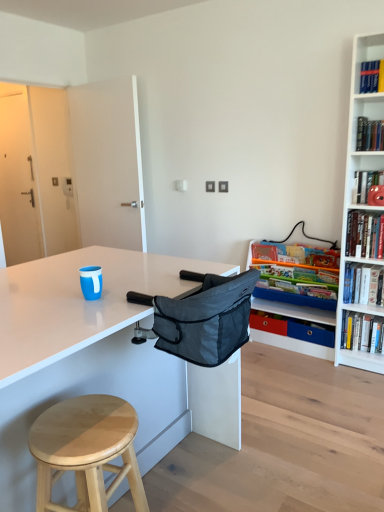
Question: Is red plastic drawer at lower right aimed at dark gray fabric folding chair at center?

Choices:
 (A) no
 (B) yes

Answer: (A)

Question: Would you say red plastic drawer at lower right is a long distance from dark gray fabric folding chair at center?

Choices:
 (A) no
 (B) yes

Answer: (B)

Question: Is red plastic drawer at lower right smaller than dark gray fabric folding chair at center?

Choices:
 (A) yes
 (B) no

Answer: (A)

Question: Is red plastic drawer at lower right behind dark gray fabric folding chair at center?

Choices:
 (A) yes
 (B) no

Answer: (A)

Question: Is the depth of red plastic drawer at lower right less than that of dark gray fabric folding chair at center?

Choices:
 (A) yes
 (B) no

Answer: (B)

Question: Is red plastic drawer at lower right taller than dark gray fabric folding chair at center?

Choices:
 (A) no
 (B) yes

Answer: (A)

Question: Does dark gray fabric folding chair at center have a greater width compared to hardcover book at upper right, marked as the fourth book in a top-to-bottom arrangement?

Choices:
 (A) yes
 (B) no

Answer: (A)

Question: Is dark gray fabric folding chair at center thinner than hardcover book at upper right, marked as the fourth book in a top-to-bottom arrangement?

Choices:
 (A) yes
 (B) no

Answer: (B)

Question: Is dark gray fabric folding chair at center positioned with its back to hardcover book at upper right, positioned as the first book in bottom-to-top order?

Choices:
 (A) yes
 (B) no

Answer: (B)

Question: Can you confirm if dark gray fabric folding chair at center is positioned to the right of hardcover book at upper right, marked as the fourth book in a top-to-bottom arrangement?

Choices:
 (A) no
 (B) yes

Answer: (A)

Question: Considering the relative sizes of dark gray fabric folding chair at center and hardcover book at upper right, marked as the fourth book in a top-to-bottom arrangement, in the image provided, is dark gray fabric folding chair at center shorter than hardcover book at upper right, marked as the fourth book in a top-to-bottom arrangement,?

Choices:
 (A) no
 (B) yes

Answer: (A)

Question: Is dark gray fabric folding chair at center next to hardcover book at upper right, positioned as the first book in bottom-to-top order, and touching it?

Choices:
 (A) no
 (B) yes

Answer: (A)

Question: From the image's perspective, does dark gray fabric folding chair at center appear lower than matte plastic shelf at right?

Choices:
 (A) no
 (B) yes

Answer: (A)